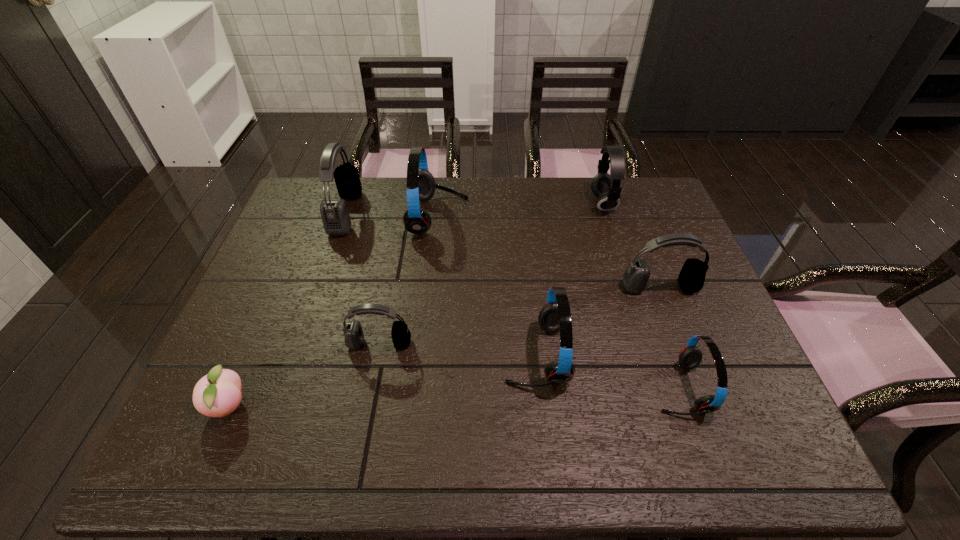
In order to click on headset that is at the left edge in this screenshot , I will do `click(335, 216)`.

Where is `peach present at the left edge`? This screenshot has height=540, width=960. peach present at the left edge is located at coordinates (217, 394).

Locate an element on the screen. The width and height of the screenshot is (960, 540). object located in the far left corner section of the desktop is located at coordinates (335, 216).

Where is `object located at the near left corner`? The height and width of the screenshot is (540, 960). object located at the near left corner is located at coordinates [x=217, y=394].

In order to click on vacant space at the far edge of the desktop in this screenshot , I will do `click(591, 211)`.

Locate an element on the screen. Image resolution: width=960 pixels, height=540 pixels. vacant space at the near edge of the desktop is located at coordinates (x=276, y=435).

In the image, there is a desktop. Identify the location of vacant space at the left edge. (286, 232).

The image size is (960, 540). In the image, there is a desktop. In order to click on vacant space at the right edge in this screenshot , I will do `click(710, 326)`.

Where is `vacant region at the near left corner of the desktop`? Image resolution: width=960 pixels, height=540 pixels. vacant region at the near left corner of the desktop is located at coordinates (177, 460).

The height and width of the screenshot is (540, 960). I want to click on vacant space at the far right corner, so click(641, 207).